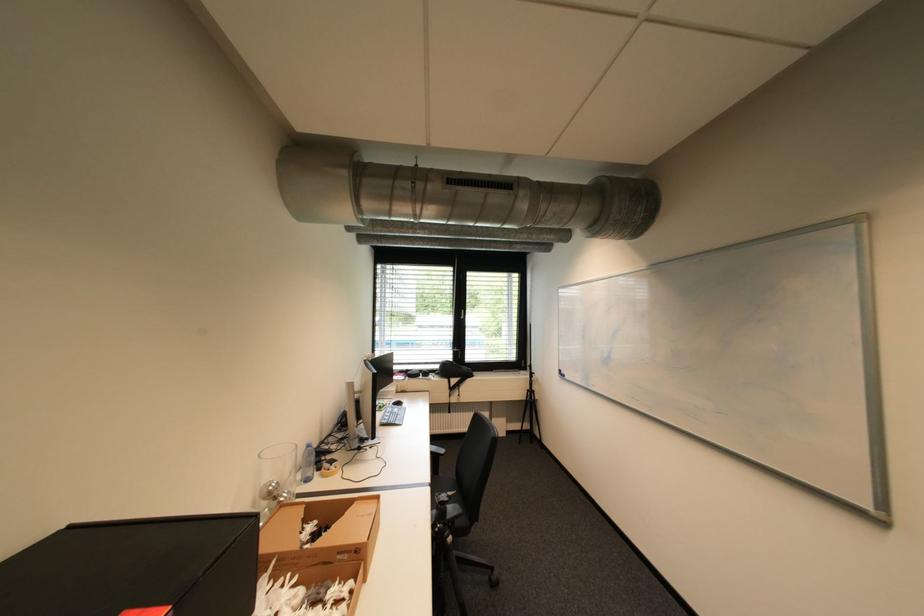
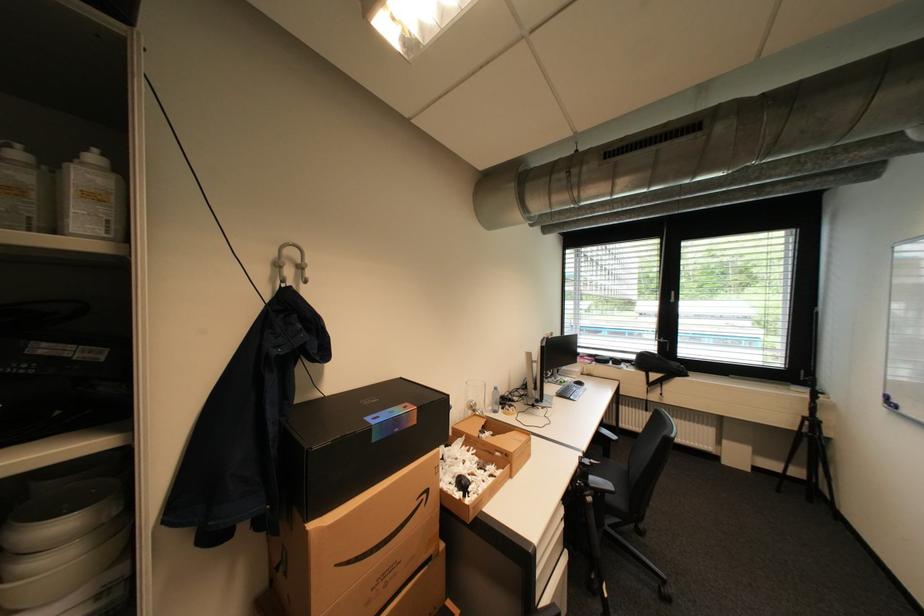
Find the pixel in the second image that matches (311,520) in the first image.

(492, 426)